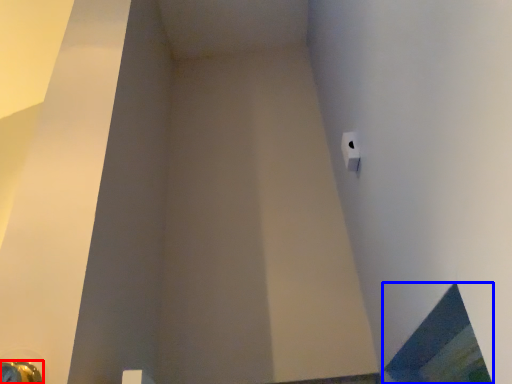
Question: Which of the following is the farthest to the observer, door handle (highlighted by a red box) or window (highlighted by a blue box)?

Choices:
 (A) door handle
 (B) window

Answer: (A)